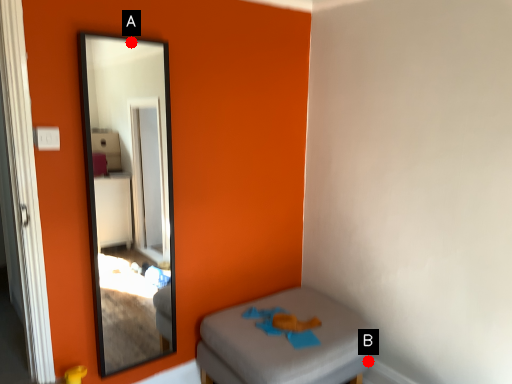
Question: Two points are circled on the image, labeled by A and B beside each circle. Which point is farther to the camera?

Choices:
 (A) A is further
 (B) B is further

Answer: (B)